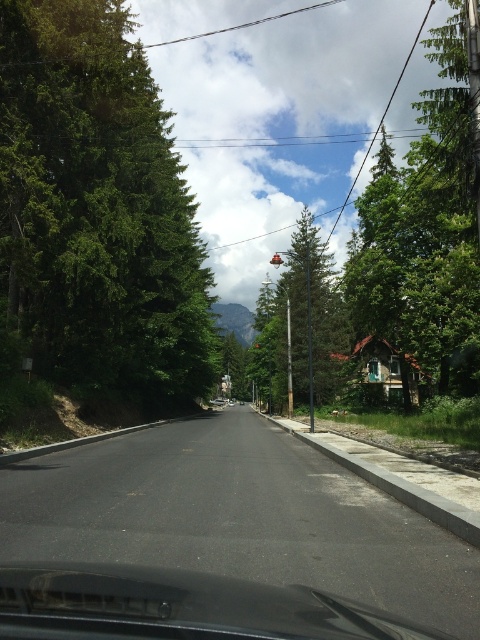
You are driving a car and want to know if the green leafy tree at upper center is closer to you than the transparent glass windshield at center. Based on the scene, can you determine which is closer?

The green leafy tree at upper center is further to the viewer than the transparent glass windshield at center, so the transparent glass windshield at center is closer to you.

You are driving a car and want to check if the green leafy tree at left is blocking your view of the road ahead. Based on the scene, can you see the road through the transparent glass windshield at center?

The green leafy tree at left is located above the transparent glass windshield at center, so the tree does not block the view of the road ahead. You can see the road through the transparent glass windshield at center.